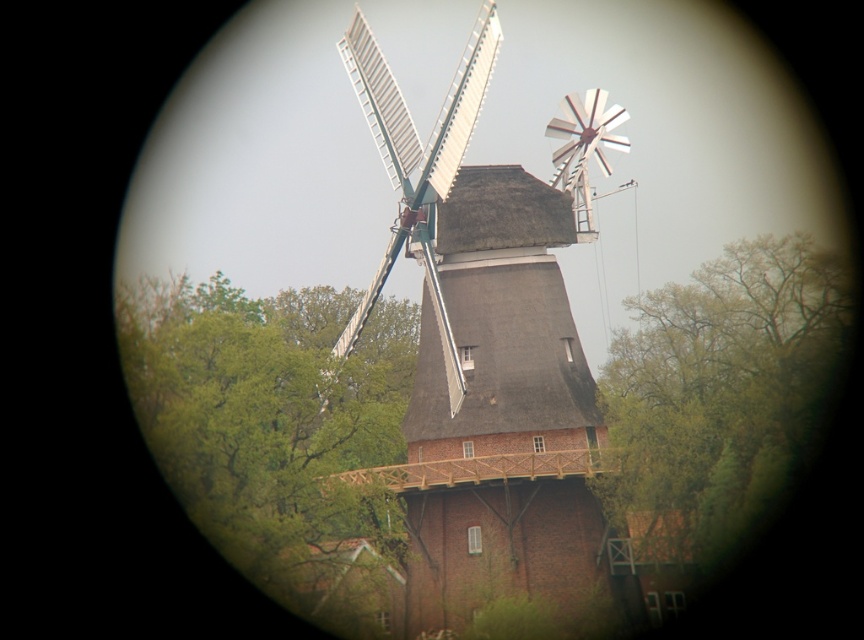
In the scene shown: Does green leafy tree at lower left appear on the right side of white painted wood windmill at center?

Incorrect, green leafy tree at lower left is not on the right side of white painted wood windmill at center.

Is the position of green leafy tree at lower left less distant than that of white painted wood windmill at center?

That is False.

Who is more forward, (x=365, y=540) or (x=391, y=129)?

Positioned in front is point (x=365, y=540).

The image size is (864, 640). I want to click on green leafy tree at lower left, so click(277, 435).

From the picture: Is green leafy tree at center bigger than white painted wood windmill at center?

Incorrect, green leafy tree at center is not larger than white painted wood windmill at center.

Is point (836, 257) behind point (383, 157)?

Yes, point (836, 257) is behind point (383, 157).

Does point (824, 273) come closer to viewer compared to point (367, 70)?

No, (824, 273) is behind (367, 70).

At what (x,y) coordinates should I click in order to perform the action: click on green leafy tree at center. Please return your answer as a coordinate pair (x, y). Looking at the image, I should click on (721, 392).

The image size is (864, 640). Describe the element at coordinates (485, 353) in the screenshot. I see `brown wooden windmill at center` at that location.

Can you confirm if brown wooden windmill at center is thinner than green leafy tree at lower left?

Indeed, brown wooden windmill at center has a lesser width compared to green leafy tree at lower left.

What do you see at coordinates (485, 353) in the screenshot? I see `brown wooden windmill at center` at bounding box center [485, 353].

Where is `brown wooden windmill at center`? The image size is (864, 640). brown wooden windmill at center is located at coordinates (485, 353).